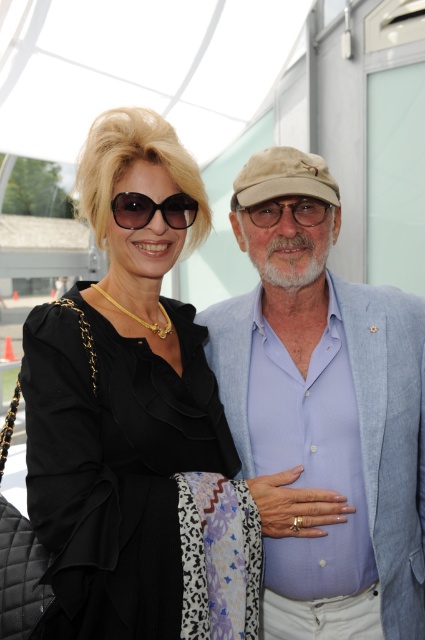
You are a photographer adjusting your camera settings. You notice two accessories in the scene, the matte black sunglasses at upper left and the matte black glasses at center. Which accessory is positioned higher in the image?

The matte black sunglasses at upper left is taller than the matte black glasses at center, so the matte black sunglasses at upper left is positioned higher in the image.

You are a photographer trying to capture a closeup shot of the sunglasses and glasses in the scene. Given that the matte black sunglasses at upper left are larger in size than the matte black glasses at center, which object would require a wider angle lens to capture fully in the frame?

The matte black sunglasses at upper left would require a wider angle lens since they are larger in size than the matte black glasses at center.

You are a photographer setting up for a photoshoot. You need to decide whether to adjust the camera focus based on the height of the objects. Given that the black satin dress at center and the matte black glasses at center are both in the frame, which object should you focus on first if you want to prioritize the taller one?

The black satin dress at center has a greater height compared to the matte black glasses at center, so you should focus on the black satin dress at center first to prioritize the taller object.